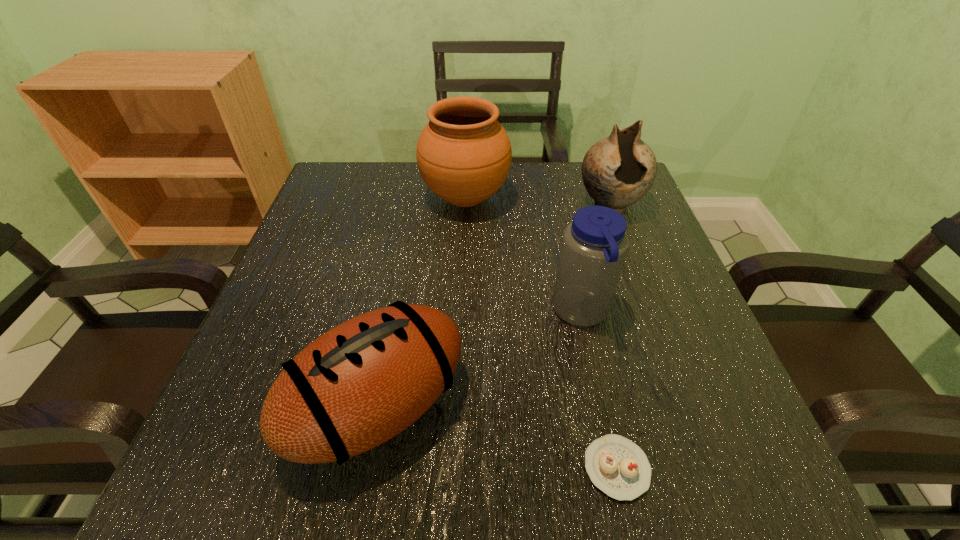
Where is `free space located 0.130m on the back of the football (American)`? This screenshot has height=540, width=960. free space located 0.130m on the back of the football (American) is located at coordinates (399, 292).

In order to click on free space located 0.360m on the left of the cupcake in this screenshot , I will do `click(327, 468)`.

Locate an element on the screen. This screenshot has height=540, width=960. football (American) located in the near edge section of the desktop is located at coordinates (358, 385).

Find the location of `cupcake located at the near edge`. cupcake located at the near edge is located at coordinates (617, 466).

The image size is (960, 540). Find the location of `object located at the left edge`. object located at the left edge is located at coordinates (358, 385).

Locate an element on the screen. The height and width of the screenshot is (540, 960). pottery present at the right edge is located at coordinates (617, 171).

Locate an element on the screen. The image size is (960, 540). water bottle at the right edge is located at coordinates (594, 245).

Where is `object that is at the near left corner`? object that is at the near left corner is located at coordinates pos(358,385).

Find the location of a particular element. object that is positioned at the far right corner is located at coordinates (617, 171).

The height and width of the screenshot is (540, 960). In the image, there is a desktop. Find the location of `vacant region at the far edge`. vacant region at the far edge is located at coordinates (459, 212).